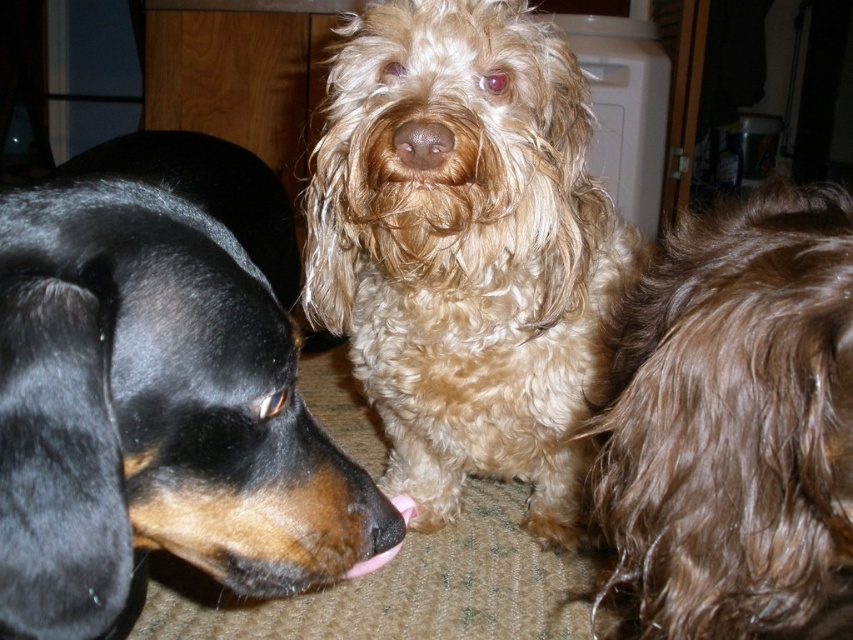
You are a photographer setting up a shoot for the black shiny coat at left and the fuzzy golden dog at center. You want to ensure that both subjects are clearly visible in the final photo. Which dog should you focus on first to make sure the other is also in focus?

The black shiny coat at left is positioned over fuzzy golden dog at center, so focusing on the black shiny coat at left first will ensure the fuzzy golden dog at center is also in focus.

You are standing in the room with the three dogs and want to throw a treat to the closest point between point [265,422] and point [450,136]. Which point should you aim for?

You should aim for point [265,422] because it is closer to you than point [450,136].